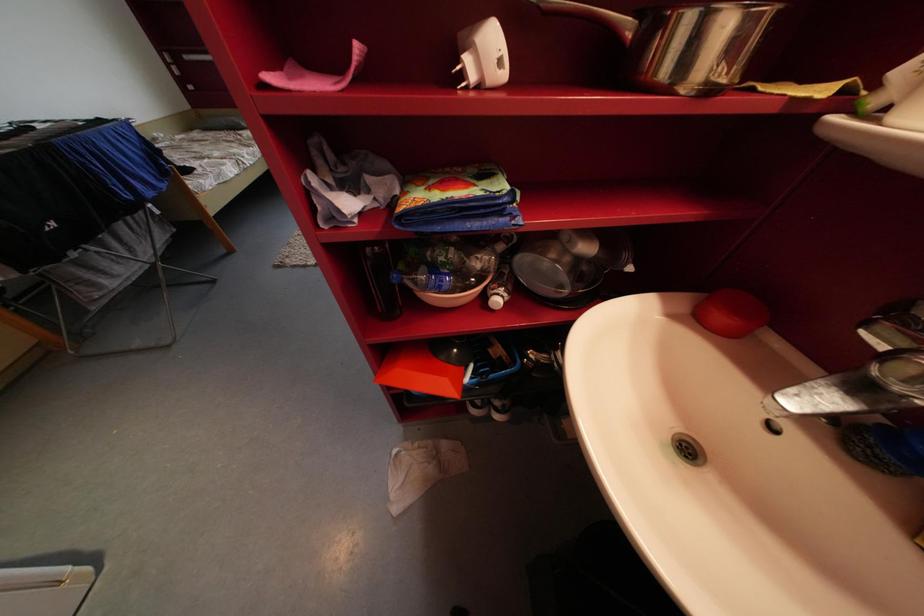
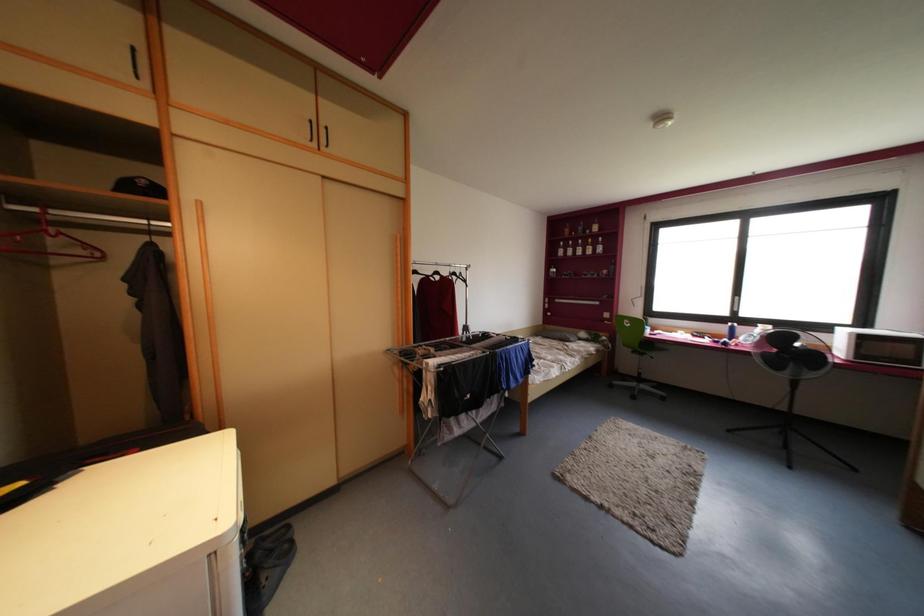
The images are taken continuously from a first-person perspective. In which direction is your viewpoint rotating?

The camera rotated toward left-up.